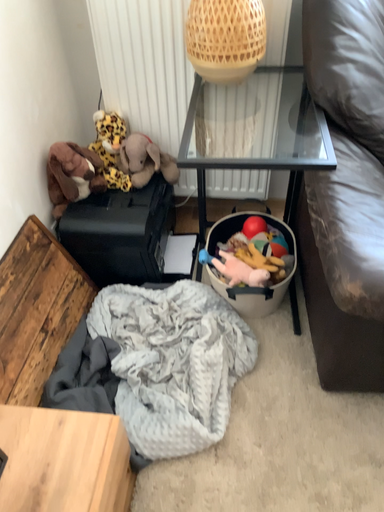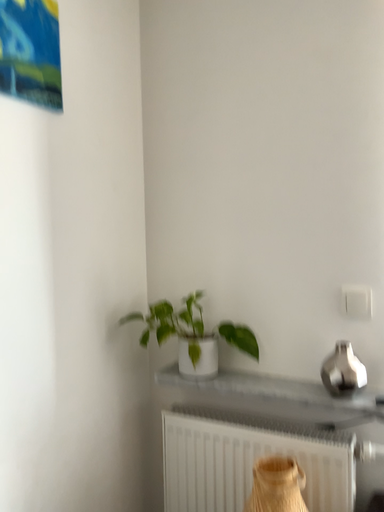
Question: How did the camera likely rotate when shooting the video?

Choices:
 (A) rotated left
 (B) rotated right

Answer: (A)